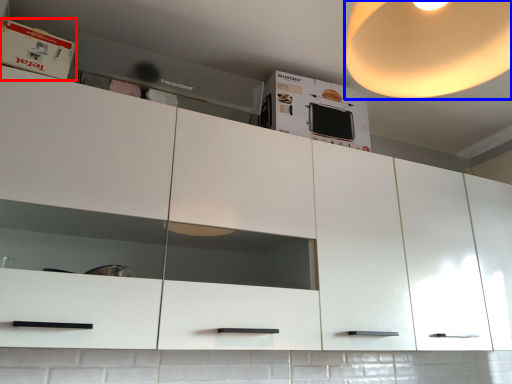
Question: Which point is further to the camera, cabinet (highlighted by a red box) or light (highlighted by a blue box)?

Choices:
 (A) cabinet
 (B) light

Answer: (A)